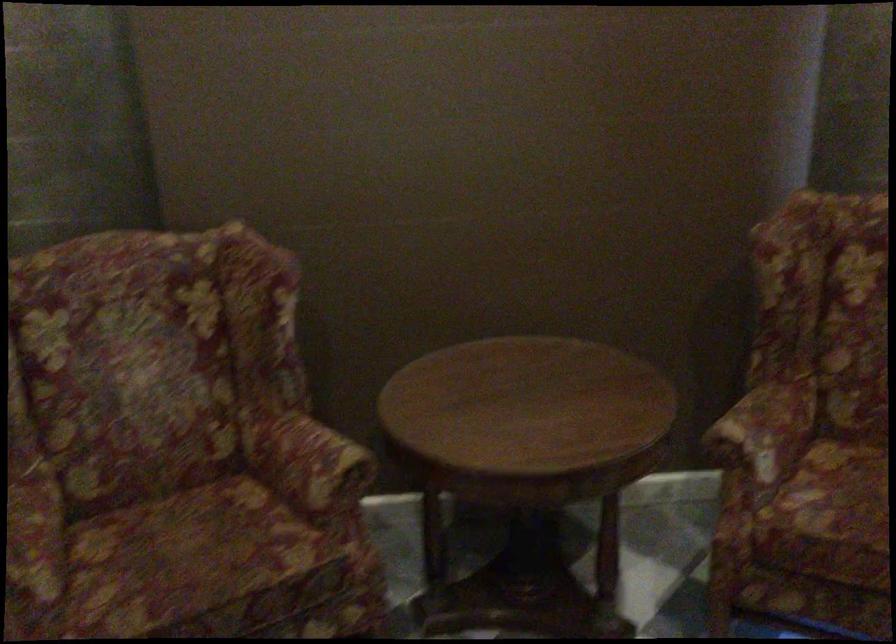
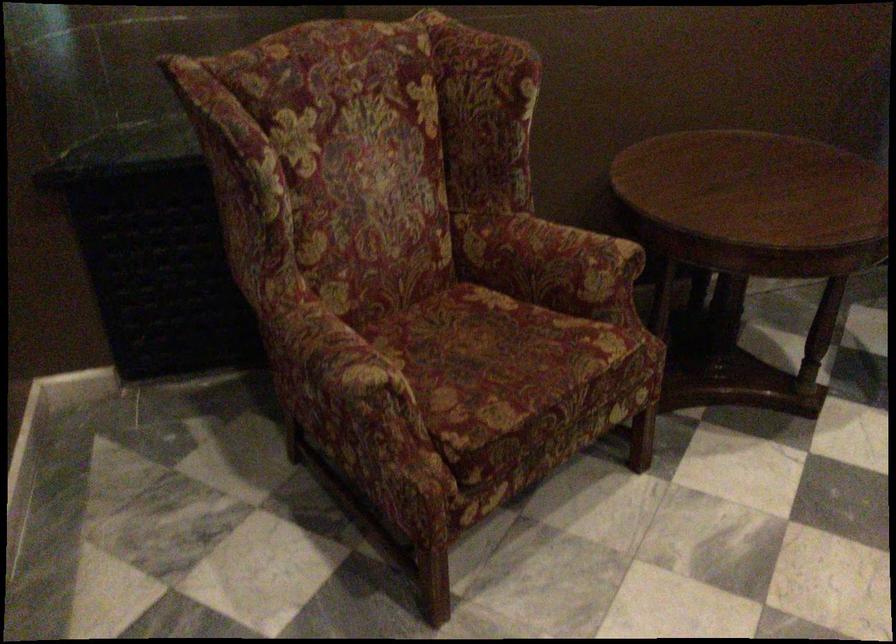
Locate, in the second image, the point that corresponds to [177,565] in the first image.

(495, 363)